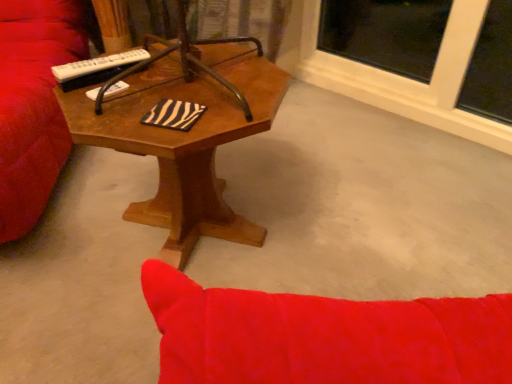
Where is `vacant region to the left of wooden coffee table at center`? Image resolution: width=512 pixels, height=384 pixels. vacant region to the left of wooden coffee table at center is located at coordinates click(69, 223).